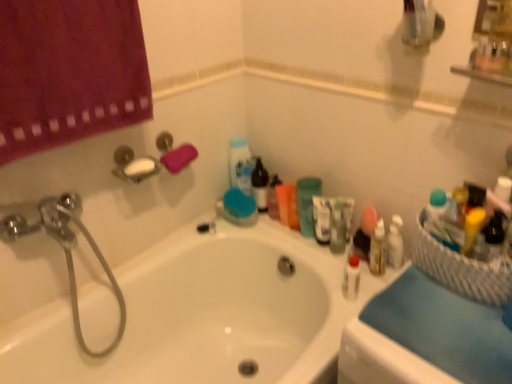
Question: From the image's perspective, relative to blue fabric at right, is green matte cup at upper center above or below?

Choices:
 (A) above
 (B) below

Answer: (A)

Question: Is green matte cup at upper center taller or shorter than blue fabric at right?

Choices:
 (A) tall
 (B) short

Answer: (A)

Question: Which is nearer to the blue fabric at right?

Choices:
 (A) green matte cup at upper center
 (B) white glossy bathtub at center
 (C) chrome metallic showerhead at upper left
 (D) pink sponge at upper left
 (E) white plastic soap dish at upper left

Answer: (B)

Question: Which object is the closest to the blue fabric at right?

Choices:
 (A) white glossy bathtub at center
 (B) chrome metallic showerhead at upper left
 (C) white wicker basket at right
 (D) white glossy bottle at center
 (E) white plastic soap dish at upper left

Answer: (C)